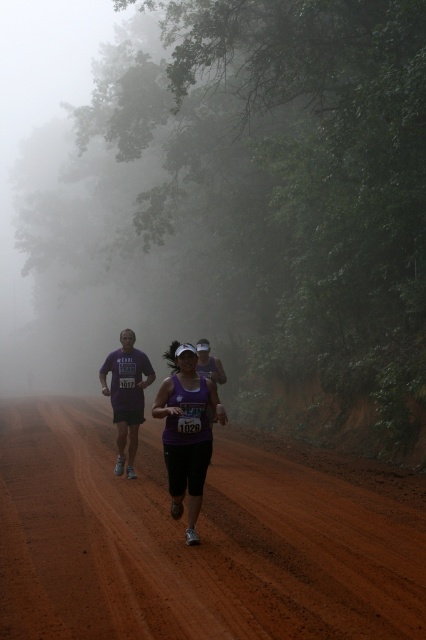
Does point (17, 547) lie behind point (135, 339)?

No, it is in front of (135, 339).

Which is above, brown dirt track at center or purple fabric runner at center?

purple fabric runner at center

Which is behind, point (294, 608) or point (135, 448)?

The point (135, 448) is behind.

Image resolution: width=426 pixels, height=640 pixels. Identify the location of brown dirt track at center. (189, 547).

Between purple fabric tank top at center and purple fabric runner at center, which one has more height?

purple fabric runner at center

Who is more forward, [175,490] or [132,397]?

Point [175,490] is more forward.

At what (x,y) coordinates should I click in order to perform the action: click on purple fabric tank top at center. Please return your answer as a coordinate pair (x, y). Looking at the image, I should click on (187, 432).

Between brown dirt track at center and purple fabric tank top at center, which one is positioned higher?

purple fabric tank top at center is higher up.

Does brown dirt track at center have a lesser height compared to purple fabric tank top at center?

Correct, brown dirt track at center is not as tall as purple fabric tank top at center.

Between point (230, 532) and point (213, 394), which one is positioned behind?

The point (213, 394) is more distant.

The image size is (426, 640). I want to click on brown dirt track at center, so [x=189, y=547].